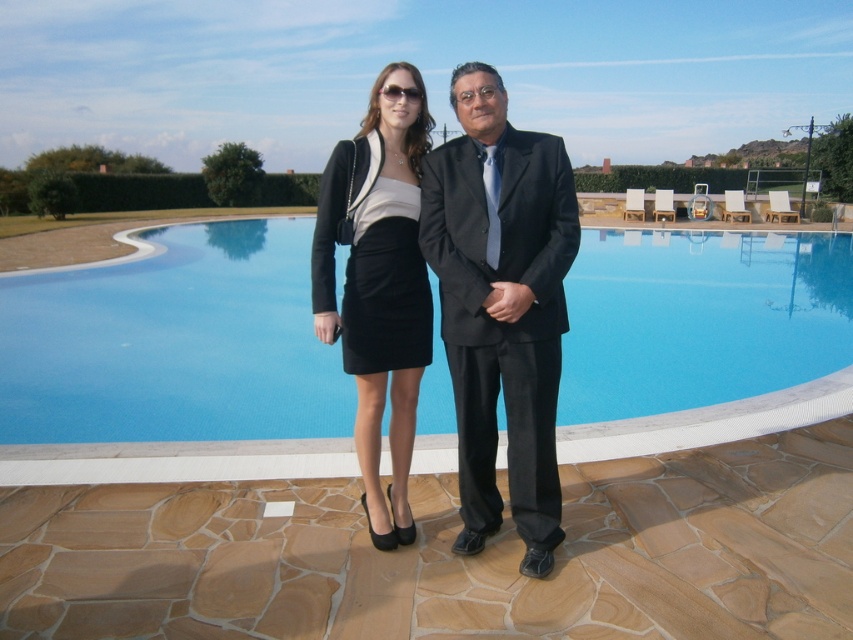
In the scene shown: Is blue glass swimming pool at center wider than black satin dress at center?

Yes.

Based on the photo, can you confirm if blue glass swimming pool at center is shorter than black satin dress at center?

No.

This screenshot has width=853, height=640. Identify the location of blue glass swimming pool at center. [x=173, y=344].

Does matte black skirt at center have a greater height compared to black satin dress at center?

Correct, matte black skirt at center is much taller as black satin dress at center.

Which is below, matte black skirt at center or black satin dress at center?

matte black skirt at center is below.

Image resolution: width=853 pixels, height=640 pixels. Identify the location of matte black skirt at center. (379, 284).

Between blue glass swimming pool at center and matte black skirt at center, which one has more height?

blue glass swimming pool at center is taller.

Does blue glass swimming pool at center appear on the left side of matte black skirt at center?

No, blue glass swimming pool at center is not to the left of matte black skirt at center.

Measure the distance between point (252,324) and camera.

They are 7.77 meters apart.

Image resolution: width=853 pixels, height=640 pixels. I want to click on blue glass swimming pool at center, so 173,344.